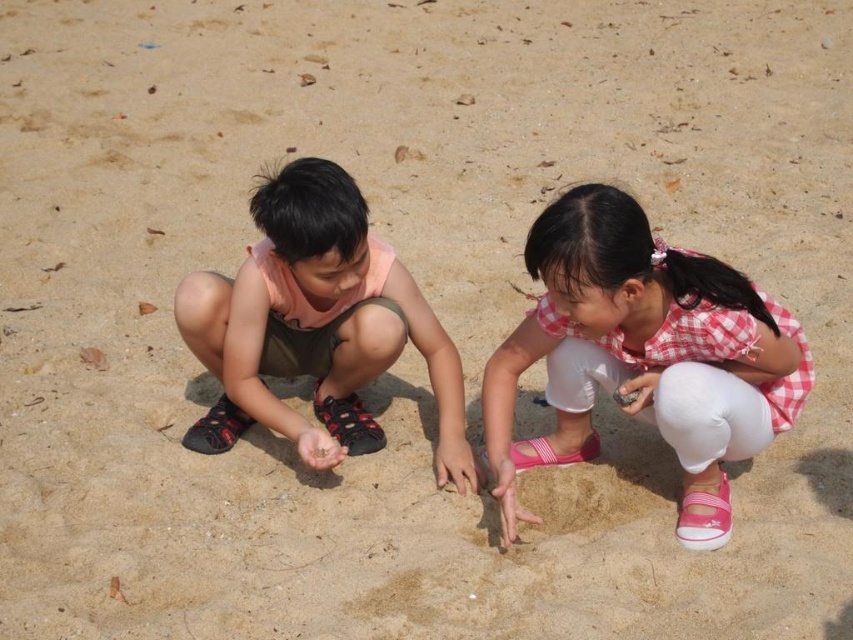
Question: Which point is closer to the camera?

Choices:
 (A) pink checkered shirt at center
 (B) matte pink shirt at center

Answer: (A)

Question: Can you confirm if pink checkered shirt at center is positioned to the right of matte pink shirt at center?

Choices:
 (A) yes
 (B) no

Answer: (A)

Question: Which object appears closest to the camera in this image?

Choices:
 (A) pink checkered shirt at center
 (B) matte pink shirt at center

Answer: (A)

Question: Does pink checkered shirt at center have a lesser width compared to matte pink shirt at center?

Choices:
 (A) yes
 (B) no

Answer: (A)

Question: Considering the relative positions of pink checkered shirt at center and matte pink shirt at center in the image provided, where is pink checkered shirt at center located with respect to matte pink shirt at center?

Choices:
 (A) below
 (B) above

Answer: (A)